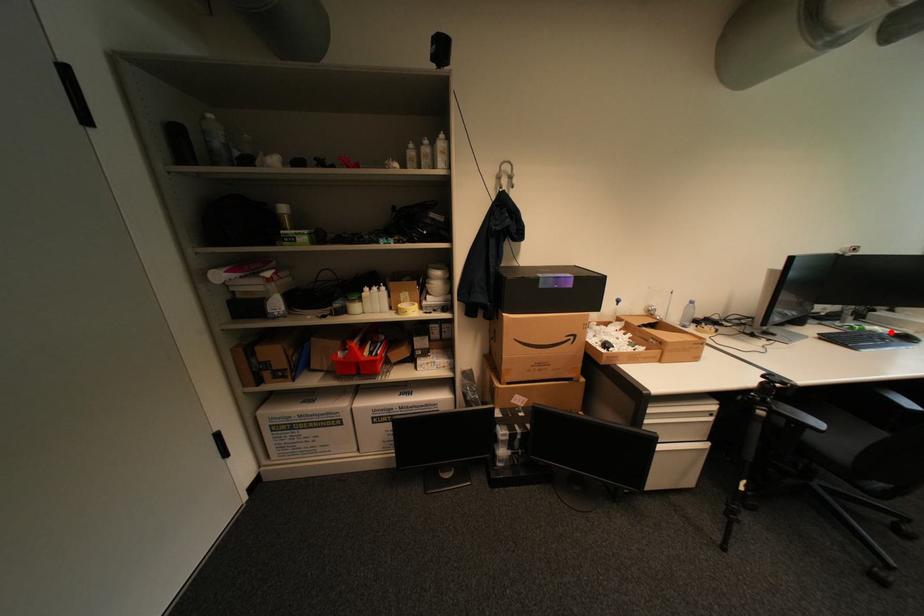
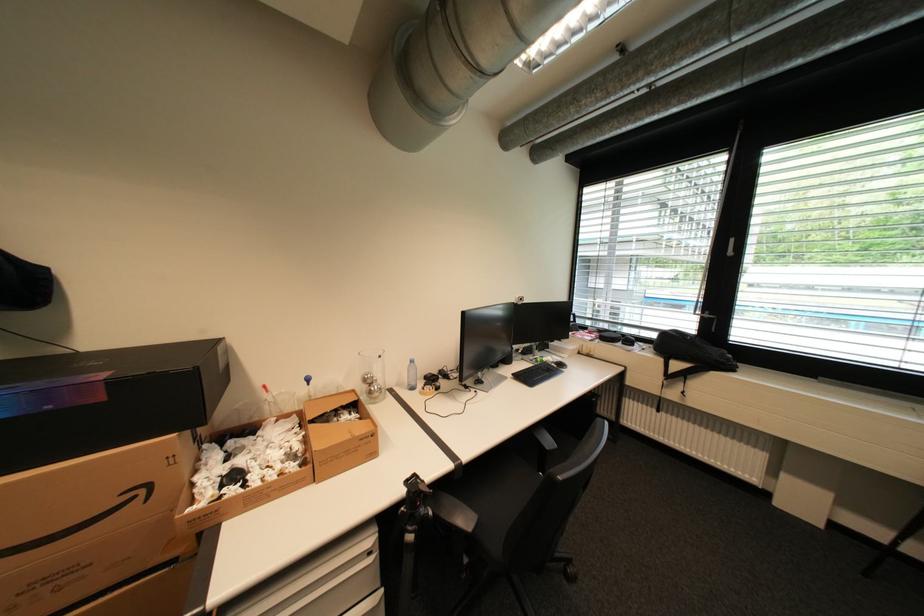
Locate, in the second image, the point that corresponds to the highlighted location in the first image.

(560, 361)